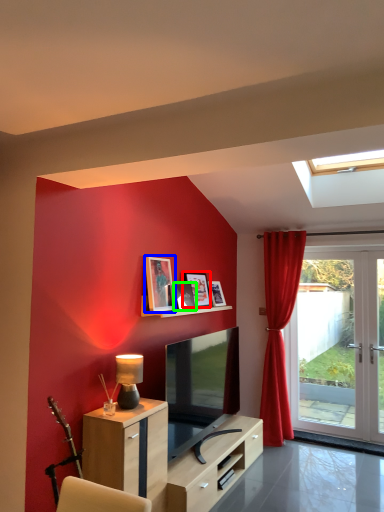
Question: Which is farther away from picture frame (highlighted by a red box)? picture frame (highlighted by a blue box) or picture frame (highlighted by a green box)?

Choices:
 (A) picture frame
 (B) picture frame

Answer: (A)